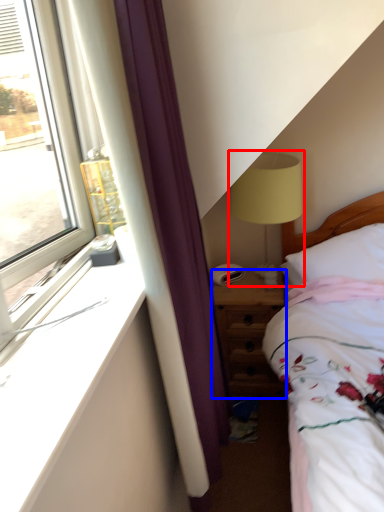
Question: Which of the following is the closest to the observer, table lamp (highlighted by a red box) or nightstand (highlighted by a blue box)?

Choices:
 (A) table lamp
 (B) nightstand

Answer: (A)